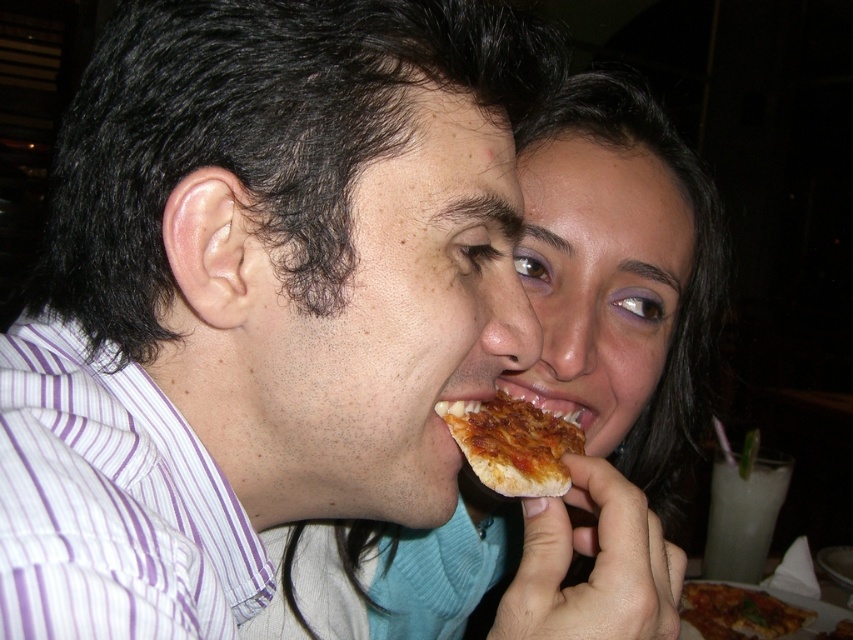
Question: Is purple striped shirt at center further to camera compared to golden crispy pizza slice at mouth?

Choices:
 (A) yes
 (B) no

Answer: (B)

Question: Can you confirm if smooth teal sweater at center is positioned to the right of golden crispy pizza at lower right?

Choices:
 (A) yes
 (B) no

Answer: (B)

Question: Among these points, which one is farthest from the camera?

Choices:
 (A) (358, 392)
 (B) (498, 426)
 (C) (770, 625)
 (D) (553, 349)

Answer: (C)

Question: Considering the real-world distances, which object is closest to the golden crispy pizza slice at mouth?

Choices:
 (A) golden crispy pizza at lower right
 (B) smooth teal sweater at center

Answer: (B)

Question: Does purple striped shirt at center have a larger size compared to golden crispy pizza slice at mouth?

Choices:
 (A) yes
 (B) no

Answer: (A)

Question: Considering the real-world distances, which object is farthest from the golden crispy pizza slice at mouth?

Choices:
 (A) golden crispy pizza at lower right
 (B) smooth teal sweater at center
 (C) purple striped shirt at center

Answer: (A)